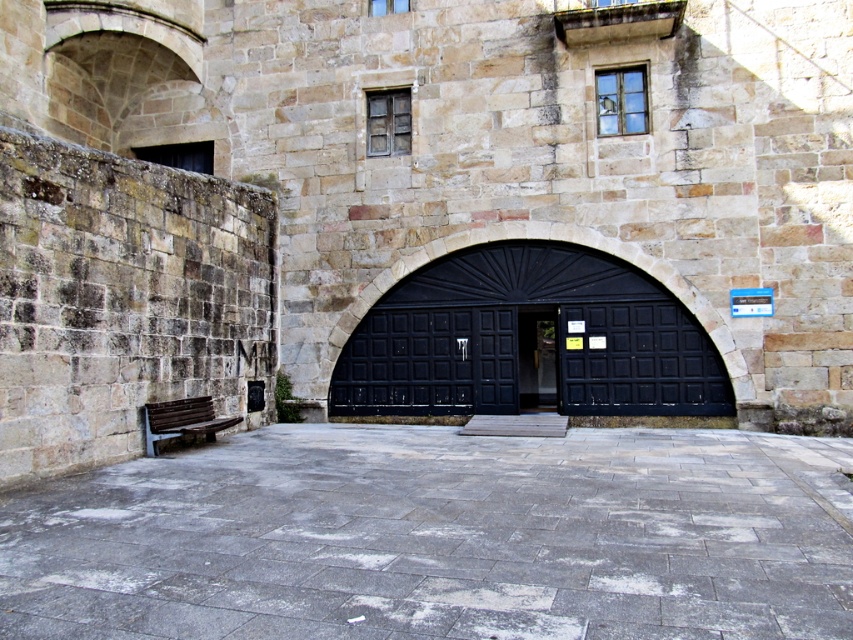
You are standing in front of the historic stone building and want to determine the relative positions of two points marked on the structure. Which point, point (561, 268) or point (183, 408), is closer to you?

Point (561, 268) is closer to you because it is further to the viewer than point (183, 408).